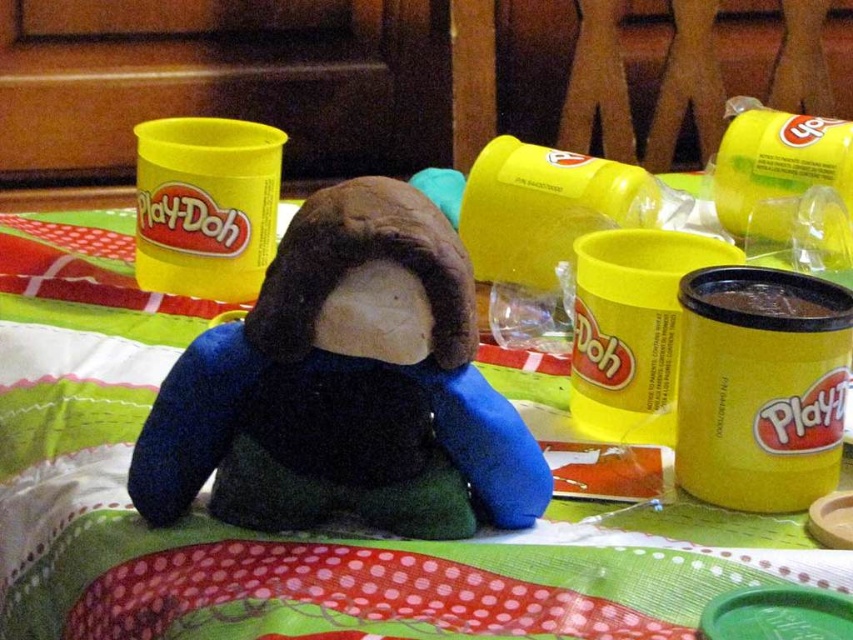
Question: Which of the following is the closest to the observer?

Choices:
 (A) (695, 374)
 (B) (67, 630)
 (C) (312, 196)

Answer: (C)

Question: Which of these objects is positioned closest to the yellow matte play-doh at center right?

Choices:
 (A) velvety brown plush at center
 (B) polka dot fabric at center

Answer: (A)

Question: Can you confirm if velvety brown plush at center is bigger than yellow matte play-doh at center right?

Choices:
 (A) no
 (B) yes

Answer: (B)

Question: Is polka dot fabric at center below yellow matte play-doh at center right?

Choices:
 (A) no
 (B) yes

Answer: (B)

Question: Can you confirm if polka dot fabric at center is positioned to the left of yellow matte play-doh at center right?

Choices:
 (A) no
 (B) yes

Answer: (B)

Question: Which of these objects is positioned closest to the polka dot fabric at center?

Choices:
 (A) velvety brown plush at center
 (B) yellow matte play-doh at center right

Answer: (A)